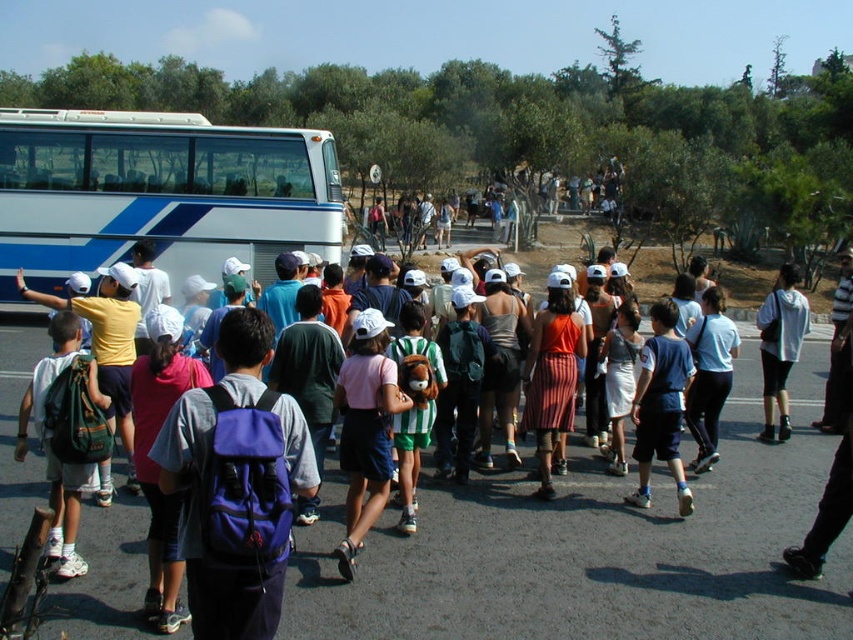
Between matte green backpack at left and blue fabric shorts at center, which one has more height?

With more height is blue fabric shorts at center.

Which is more to the right, matte green backpack at left or blue fabric shorts at center?

blue fabric shorts at center is more to the right.

Where is `matte green backpack at left`? This screenshot has width=853, height=640. matte green backpack at left is located at coordinates (67, 433).

Is multicolored striped shirts at center taller than gray hoodie at center?

Correct, multicolored striped shirts at center is much taller as gray hoodie at center.

Between multicolored striped shirts at center and gray hoodie at center, which one is positioned lower?

gray hoodie at center is lower down.

Is point (595, 209) positioned after point (772, 339)?

Yes.

This screenshot has height=640, width=853. I want to click on multicolored striped shirts at center, so click(x=538, y=205).

Does purple backpack at center have a lesser width compared to purple fabric backpack at center?

Incorrect, purple backpack at center's width is not less than purple fabric backpack at center's.

Does purple backpack at center appear on the left side of purple fabric backpack at center?

Yes, purple backpack at center is to the left of purple fabric backpack at center.

What do you see at coordinates (495, 561) in the screenshot? The image size is (853, 640). I see `purple backpack at center` at bounding box center [495, 561].

The image size is (853, 640). Identify the location of purple backpack at center. (495, 561).